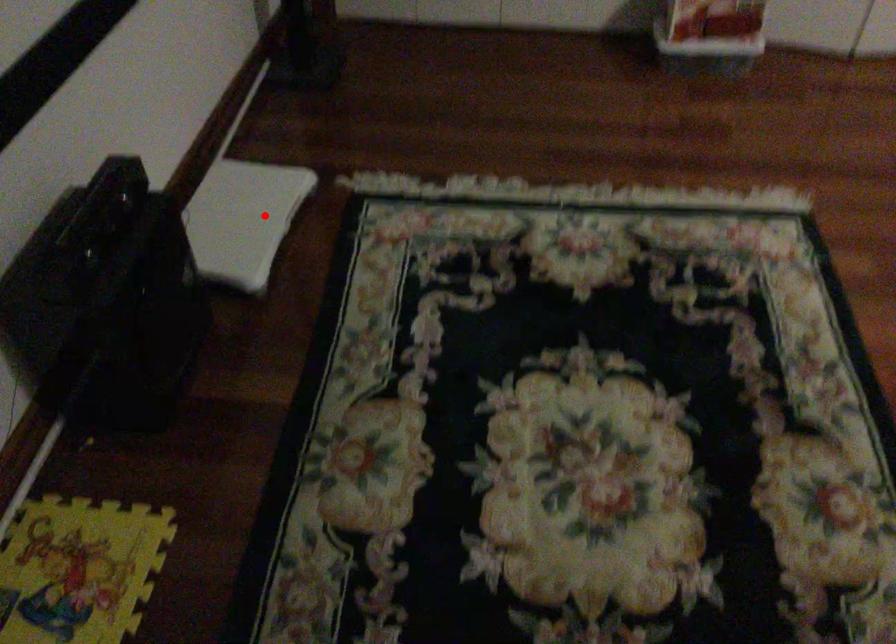
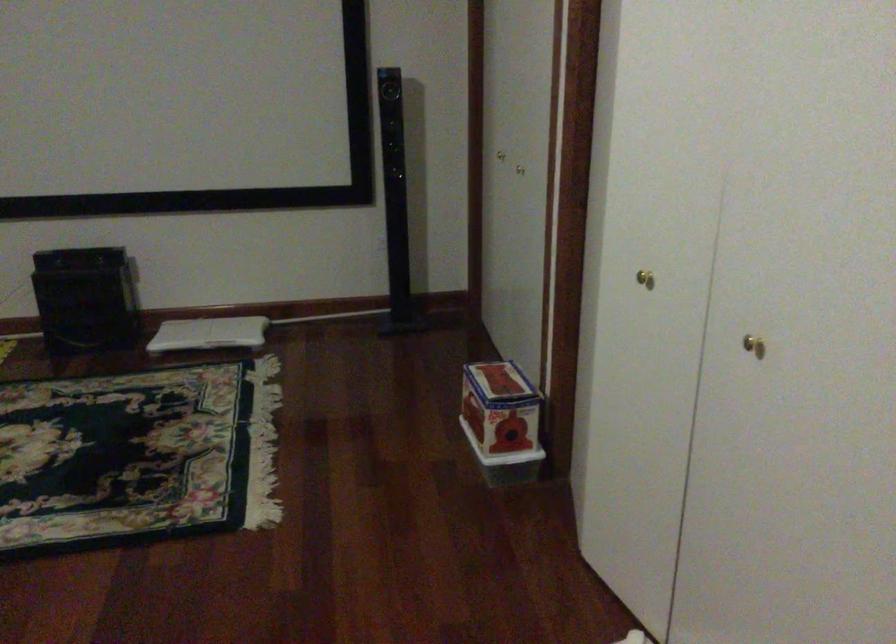
Find the pixel in the second image that matches the highlighted location in the first image.

(209, 333)